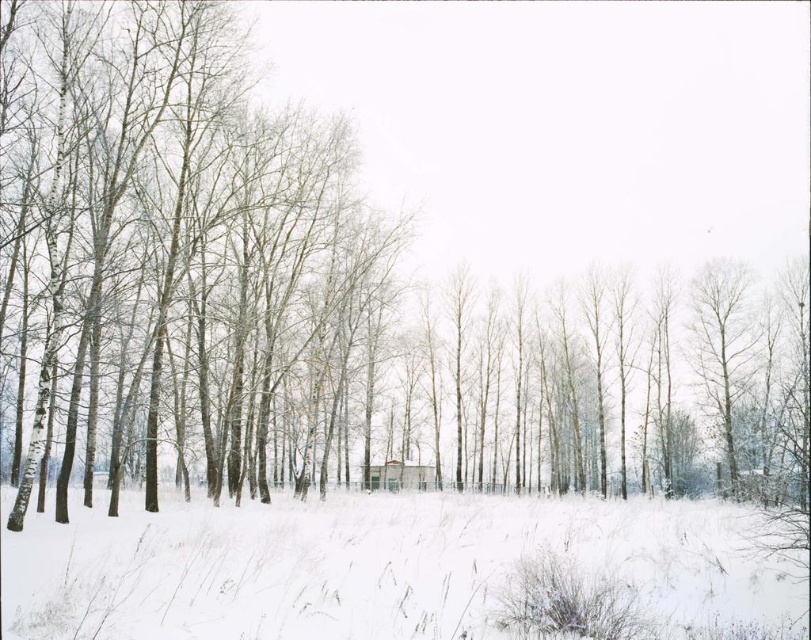
Question: Does white snow at center have a larger size compared to white wooden cabin at center?

Choices:
 (A) no
 (B) yes

Answer: (B)

Question: Among these objects, which one is nearest to the camera?

Choices:
 (A) white wooden cabin at center
 (B) white snow at center

Answer: (B)

Question: Is white snow at center above white wooden cabin at center?

Choices:
 (A) yes
 (B) no

Answer: (A)

Question: Which point is farther to the camera?

Choices:
 (A) (719, 620)
 (B) (410, 483)

Answer: (B)

Question: Does white snow at center have a larger size compared to white wooden cabin at center?

Choices:
 (A) no
 (B) yes

Answer: (B)